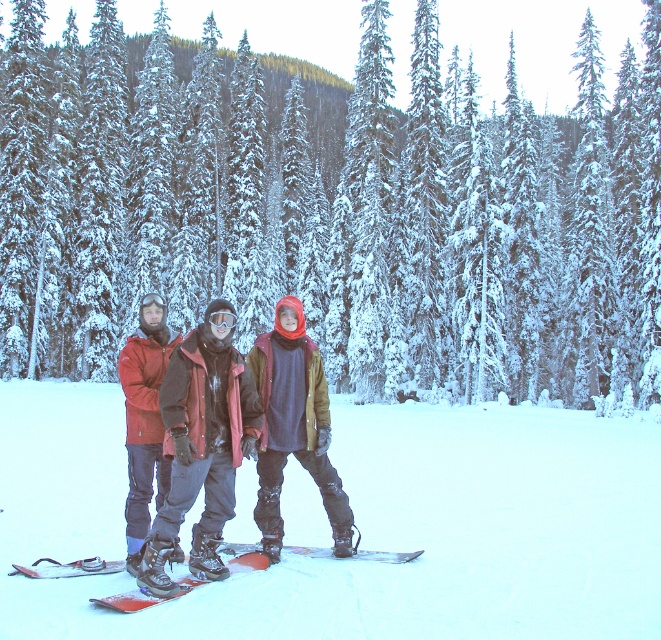
You are planning to take a photo of the matte red jacket at center and the red matte snowboard at center in the snowy landscape. Which object appears narrower in the photo?

The matte red jacket at center appears narrower than the red matte snowboard at center because it has a lesser width compared to it.

You are standing at the origin point of the coordinate system. You see a point marked at coordinate [143,419]. What object is located at that point?

The point at coordinate [143,419] marks the location of the matte red jacket at center.